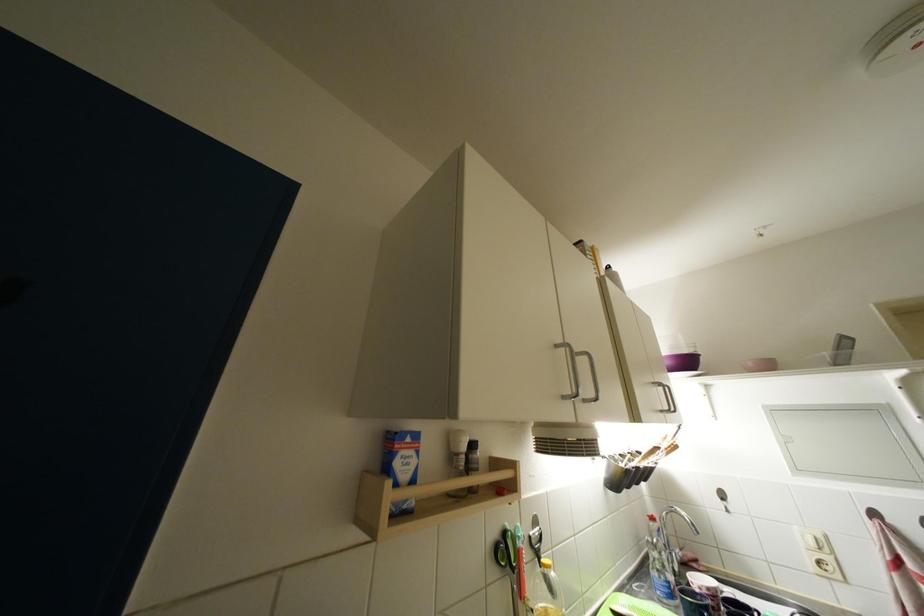
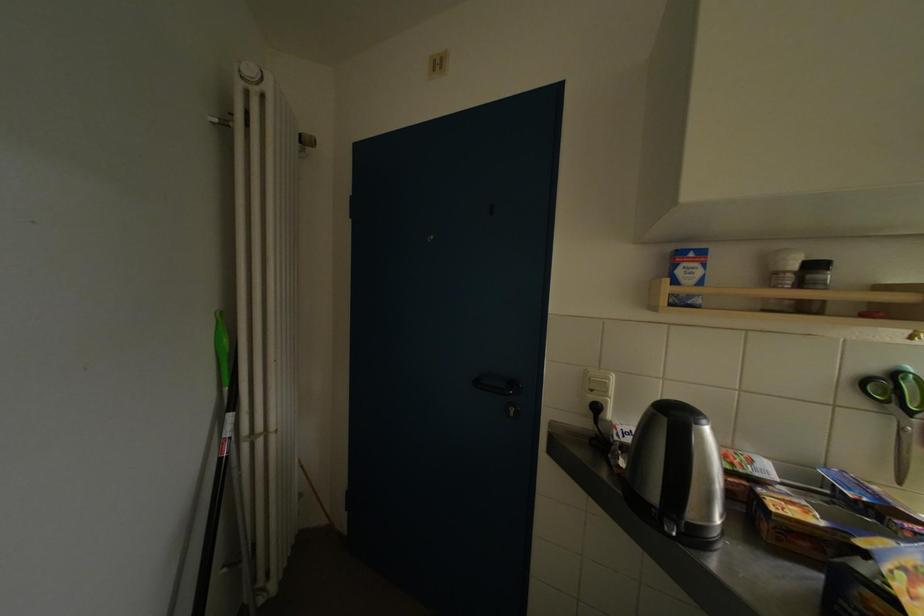
Locate, in the second image, the point that corresponds to pixel 464 458 in the first image.

(784, 277)